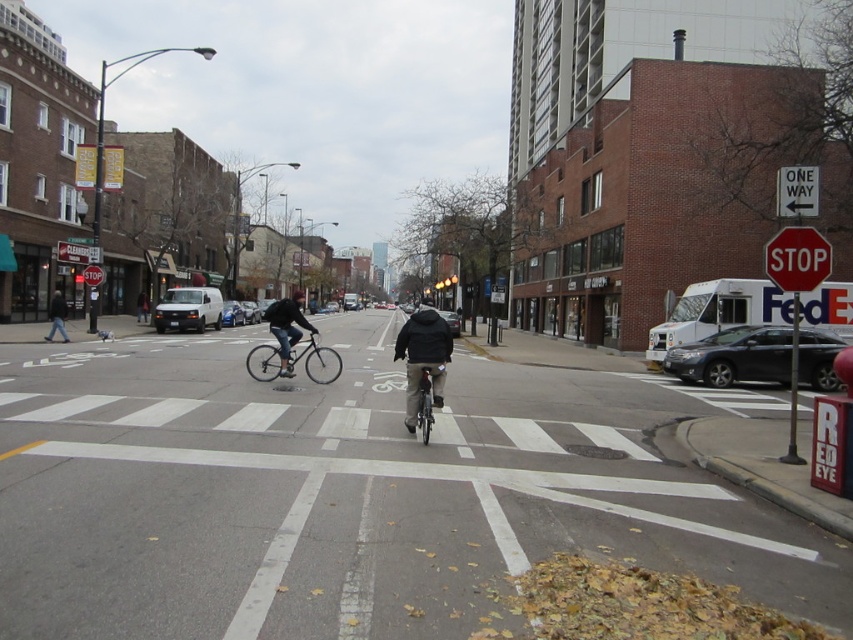
Question: Is dark blue jeans at lower left to the left of blue metallic car at center from the viewer's perspective?

Choices:
 (A) no
 (B) yes

Answer: (B)

Question: Estimate the real-world distances between objects in this image. Which object is farther from the dark blue jeans at lower left?

Choices:
 (A) black matte car at center
 (B) dark gray jacket at center
 (C) black matte sedan at center right

Answer: (C)

Question: Can you confirm if matte black jacket at center is wider than blue metallic car at center?

Choices:
 (A) no
 (B) yes

Answer: (B)

Question: Can you confirm if red metal stop sign at upper right is positioned to the left of matte black jacket at center?

Choices:
 (A) yes
 (B) no

Answer: (B)

Question: Which of the following is the closest to the observer?

Choices:
 (A) (764, 330)
 (B) (244, 312)

Answer: (A)

Question: Which object is positioned farthest from the metallic silver bicycle at center?

Choices:
 (A) black matte sedan at center right
 (B) black matte car at center

Answer: (A)